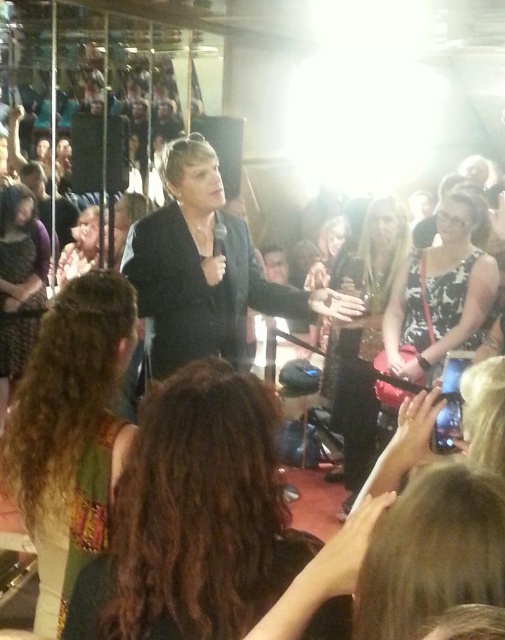
You are a photographer at the event and want to capture a clear photo of the person in the floral dress at center without the person in the matte black jacket at left blocking the view. Based on their heights, is this possible?

The floral dress at center is much taller than the matte black jacket at left, so it is possible to capture a clear photo of the person in the floral dress at center without obstruction from the matte black jacket at left due to the height difference.

You are a photographer at the event and want to capture a photo that includes both the floral dress at center and the matte black jacket at left. Based on their positions, which one should you focus on first to ensure both are in the frame?

The floral dress at center is below the matte black jacket at left, so you should focus on the matte black jacket at left first to ensure both are in the frame.

You are a photographer at the event and need to capture a photo that includes both the curly hair at center and the matte black jacket at left. What is the minimum distance you should set your camera lens to ensure both subjects are in frame?

The minimum distance required is 9.30 feet to ensure both the curly hair at center and the matte black jacket at left are in frame as they are 9.30 feet apart from each other.